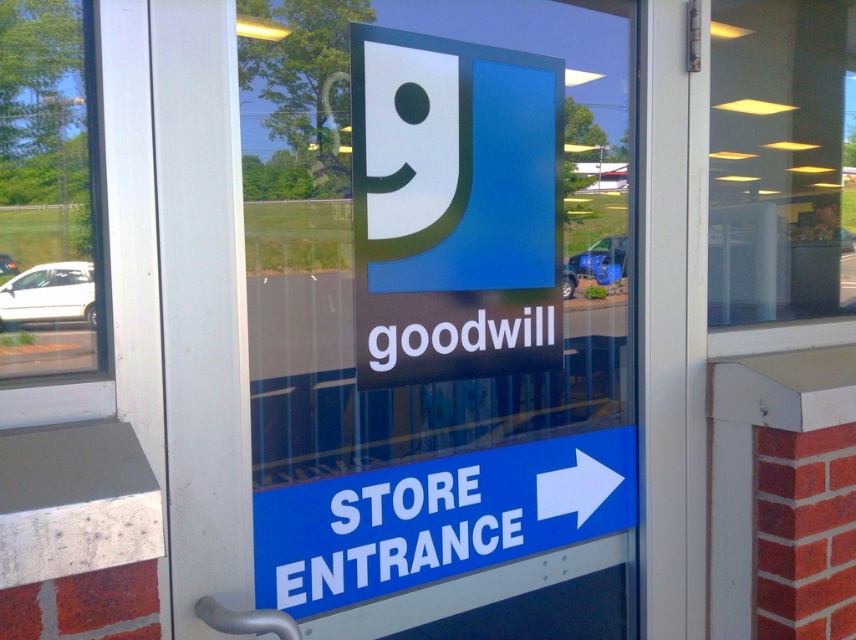
Question: Which point appears farthest from the camera in this image?

Choices:
 (A) (455, 179)
 (B) (88, 305)
 (C) (816, 145)

Answer: (C)

Question: Which of the following is the farthest from the observer?

Choices:
 (A) (389, 508)
 (B) (67, 77)

Answer: (A)

Question: In this image, where is transparent glass window at left located relative to white plastic arrow at right?

Choices:
 (A) above
 (B) below

Answer: (A)

Question: Can you confirm if transparent glass door at center is positioned to the left of transparent glass window at left?

Choices:
 (A) no
 (B) yes

Answer: (A)

Question: Which point appears closest to the camera in this image?

Choices:
 (A) (586, 266)
 (B) (504, 68)
 (C) (88, 68)
 (D) (724, 269)

Answer: (C)

Question: Can you confirm if matte plastic sign at center is smaller than transparent glass window at left?

Choices:
 (A) yes
 (B) no

Answer: (B)